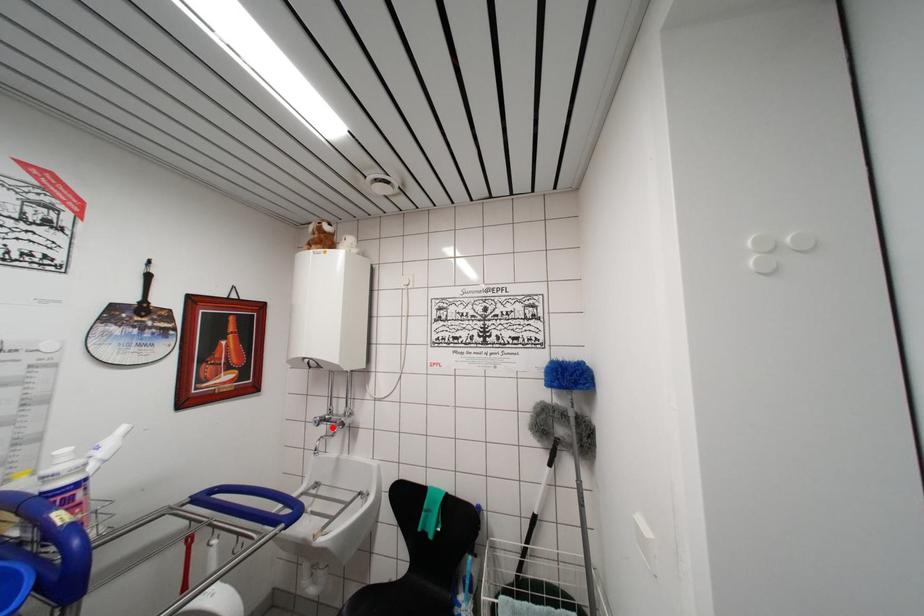
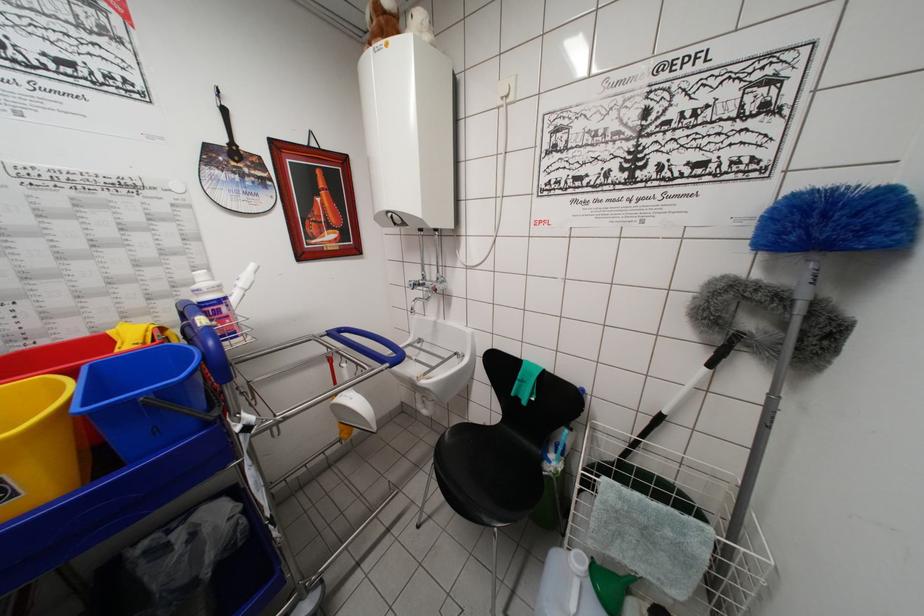
Find the pixel in the second image that matches the highlighted location in the first image.

(428, 294)